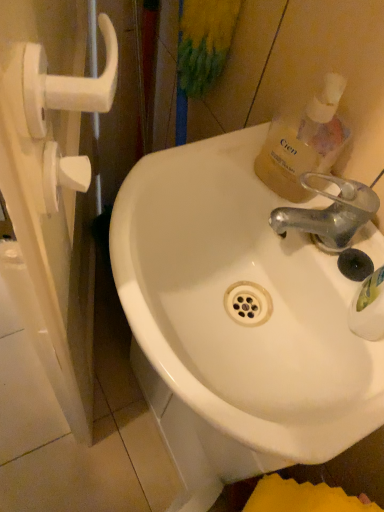
Question: Is point (249, 224) closer or farther from the camera than point (367, 198)?

Choices:
 (A) closer
 (B) farther

Answer: (B)

Question: Relative to metallic silver faucet at upper right, is white glossy sink at center in front or behind?

Choices:
 (A) front
 (B) behind

Answer: (A)

Question: Which of these objects is positioned closest to the metallic silver faucet at upper right?

Choices:
 (A) translucent plastic bottle at upper right
 (B) white plastic handle at left
 (C) white glossy sink at center

Answer: (A)

Question: Which is farther from the metallic silver faucet at upper right?

Choices:
 (A) translucent plastic bottle at upper right
 (B) white glossy sink at center
 (C) white plastic handle at left

Answer: (C)